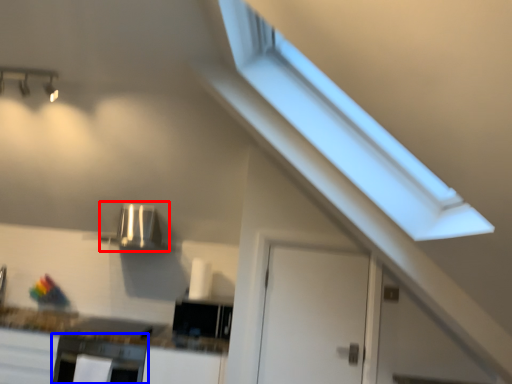
Question: Which object appears closest to the camera in this image, appliance (highlighted by a red box) or oven (highlighted by a blue box)?

Choices:
 (A) appliance
 (B) oven

Answer: (B)